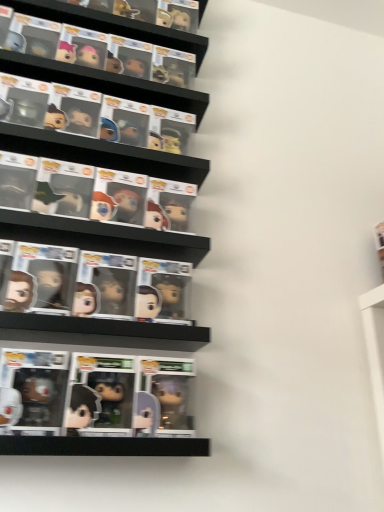
Question: From their relative heights in the image, would you say translucent plastic figure at center, which ranks as the second comic book in right-to-left order, is taller or shorter than shiny plastic figure at center, arranged as the first comic book when viewed from the right?

Choices:
 (A) tall
 (B) short

Answer: (B)

Question: From the image's perspective, is translucent plastic figure at center, which ranks as the first comic book in left-to-right order, above or below shiny plastic figure at center, arranged as the first comic book when viewed from the right?

Choices:
 (A) above
 (B) below

Answer: (A)

Question: In the image, is translucent plastic figure at center, which ranks as the second comic book in right-to-left order, on the left side or the right side of shiny plastic figure at center, arranged as the first comic book when viewed from the right?

Choices:
 (A) left
 (B) right

Answer: (A)

Question: From the image's perspective, is shiny plastic figure at center, arranged as the first comic book when viewed from the right, positioned above or below translucent plastic figure at center, which ranks as the second comic book in right-to-left order?

Choices:
 (A) below
 (B) above

Answer: (A)

Question: Is shiny plastic figure at center, the 2th comic book in the left-to-right sequence, inside the boundaries of translucent plastic figure at center, which ranks as the first comic book in left-to-right order, or outside?

Choices:
 (A) inside
 (B) outside

Answer: (B)

Question: Is point (162, 305) closer or farther from the camera than point (104, 295)?

Choices:
 (A) closer
 (B) farther

Answer: (B)

Question: Relative to translucent plastic figure at center, which ranks as the second comic book in right-to-left order, is shiny plastic figure at center, the 2th comic book in the left-to-right sequence, in front or behind?

Choices:
 (A) behind
 (B) front

Answer: (A)